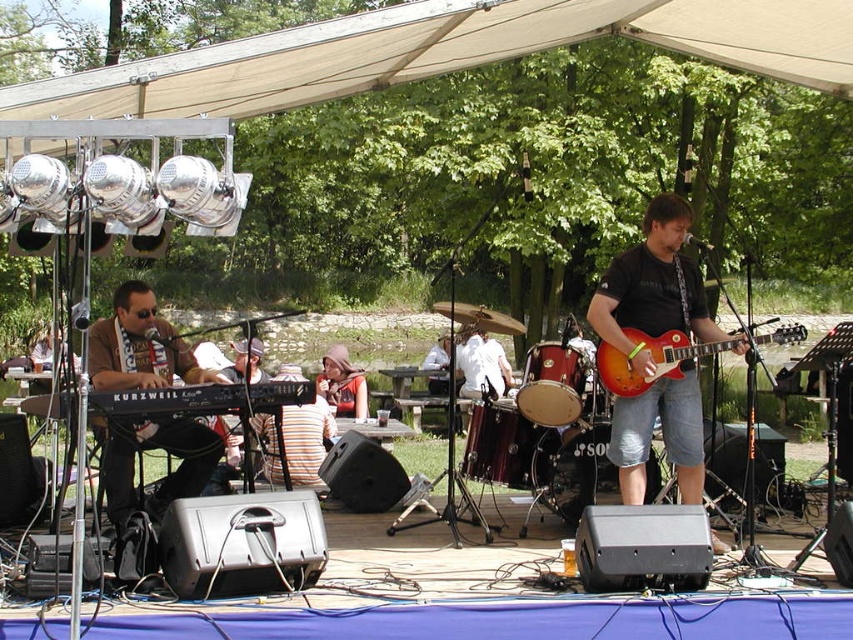
Question: Does black plastic keyboard at left appear over glossy wood guitar at center right?

Choices:
 (A) no
 (B) yes

Answer: (A)

Question: Which object appears closest to the camera in this image?

Choices:
 (A) wooden drum at center
 (B) glossy wood guitar at center right

Answer: (B)

Question: Is satin red guitar at center closer to the viewer compared to black matte keyboard at center?

Choices:
 (A) yes
 (B) no

Answer: (B)

Question: Which of the following is the farthest from the observer?

Choices:
 (A) (291, 380)
 (B) (318, 380)

Answer: (B)

Question: Which object is the farthest from the striped fabric shirt at center?

Choices:
 (A) glossy wood guitar at center right
 (B) matte brown hat at center
 (C) black plastic keyboard at left

Answer: (A)

Question: Can you confirm if black matte keyboard at center is smaller than glossy wood guitar at center right?

Choices:
 (A) yes
 (B) no

Answer: (A)